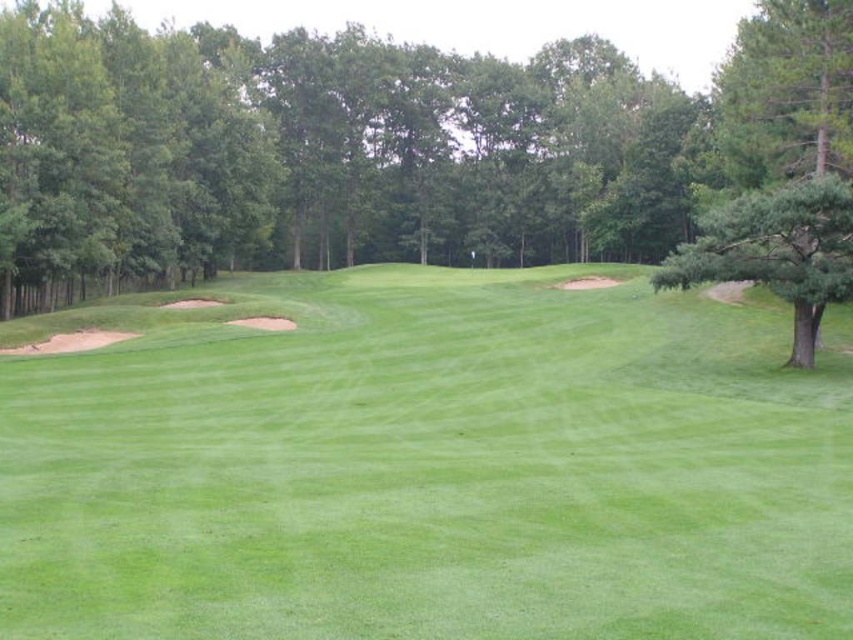
You are standing at the origin point of the golf course. You need to hit a golf ball to the green grassy fairway at lower left. What are the coordinates you should aim for?

The coordinates to aim for are point (427,465).

You are standing on the golf course and want to hit a ball towards the green leafy tree at center and the green textured tree at right. Which tree will your ball reach first if you hit them at the same time?

The green leafy tree at center will be reached first because it is closer to you than the green textured tree at right.

Looking at this image, you are a golfer standing on the green grassy fairway at lower left and looking towards the green leafy tree at center. Which area covers more ground in the image?

The green leafy tree at center occupies more space in the image than the green grassy fairway at lower left.